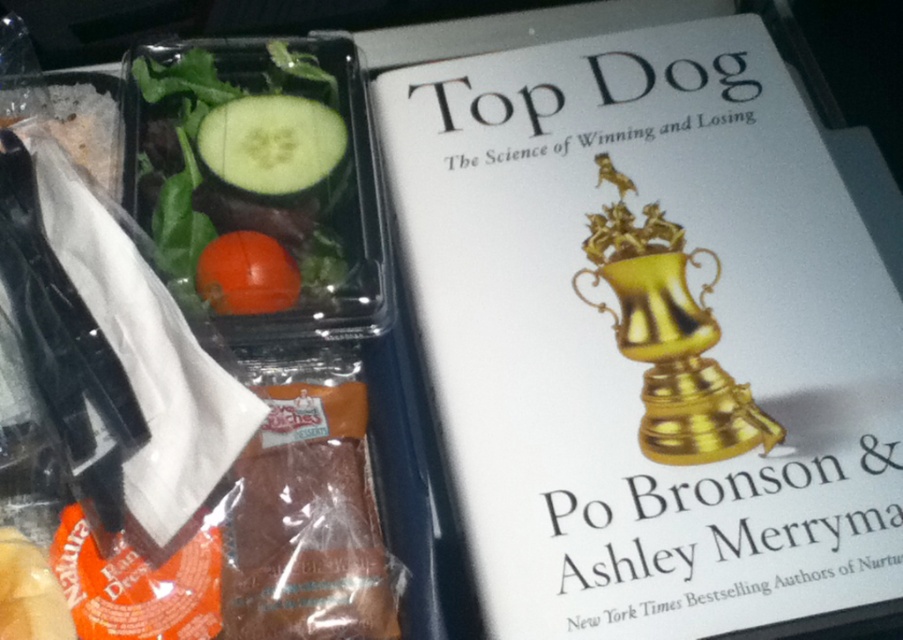
Question: Is green matte cucumber at upper left bigger than green matte cucumber at center?

Choices:
 (A) yes
 (B) no

Answer: (A)

Question: Which point is farther to the camera?

Choices:
 (A) glossy orange tomato at center-left
 (B) green matte cucumber at upper left
 (C) green matte cucumber at center

Answer: (C)

Question: Which point appears closest to the camera in this image?

Choices:
 (A) (x=230, y=241)
 (B) (x=287, y=211)

Answer: (A)

Question: Can you confirm if green matte cucumber at center is positioned to the right of glossy orange tomato at center-left?

Choices:
 (A) yes
 (B) no

Answer: (A)

Question: Where is green matte cucumber at upper left located in relation to glossy orange tomato at center-left in the image?

Choices:
 (A) below
 (B) above

Answer: (B)

Question: Which point appears farthest from the camera in this image?

Choices:
 (A) (296, 100)
 (B) (281, 289)
 (C) (293, 285)

Answer: (A)